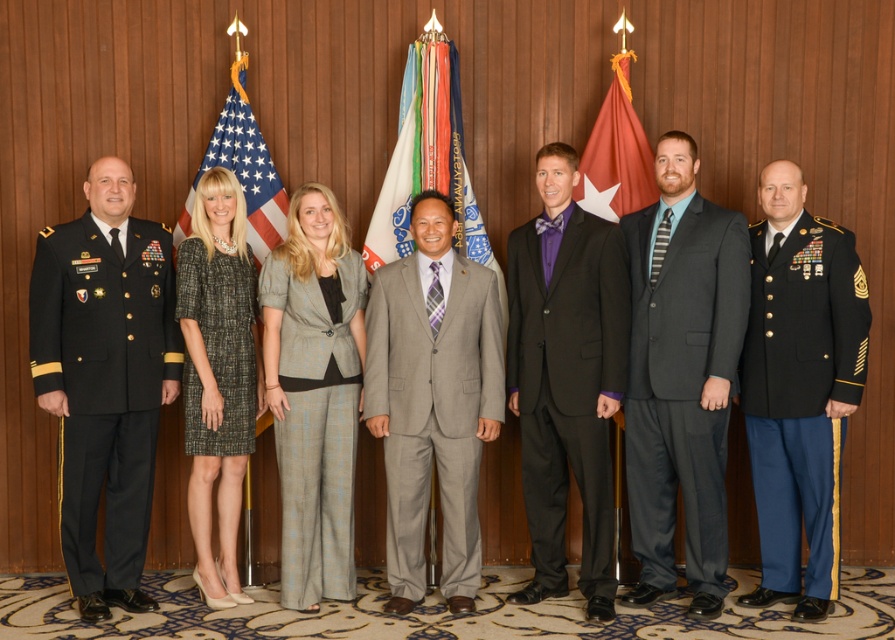
You are an event planner arranging a photo shoot for the ceremony. You need to ensure that the gray wool suit at center is visible in the photo. Given that the silky fabric flag at center might block the view, where should you position the camera relative to the flag?

The gray wool suit at center is located below the silky fabric flag at center, so positioning the camera below the flag would ensure the suit is visible without obstruction.